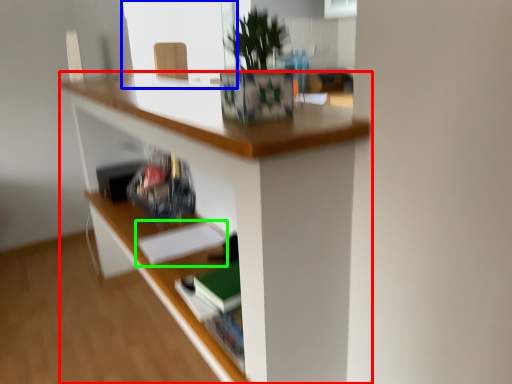
Question: Which object is the farthest from desk (highlighted by a red box)? Choose among these: window screen (highlighted by a blue box) or paperback book (highlighted by a green box).

Choices:
 (A) window screen
 (B) paperback book

Answer: (A)